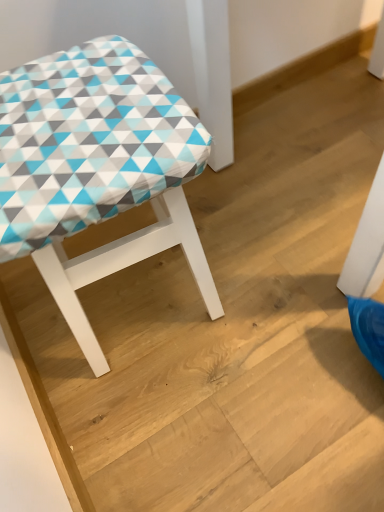
This screenshot has width=384, height=512. Identify the location of free location above matte fabric stool at center (from a real-world perspective). (79, 105).